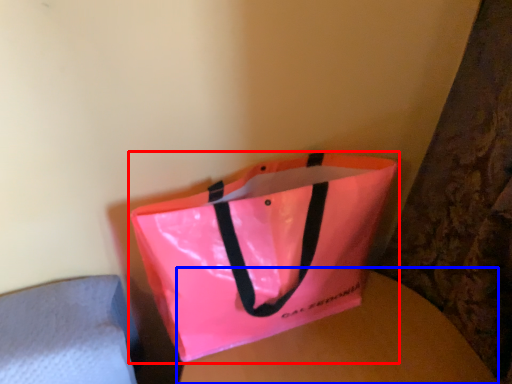
Question: Which object is closer to the camera taking this photo, handbag (highlighted by a red box) or round table (highlighted by a blue box)?

Choices:
 (A) handbag
 (B) round table

Answer: (A)